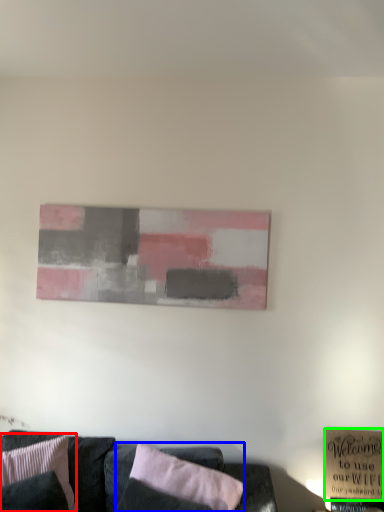
Question: Estimate the real-world distances between objects in this image. Which object is closer to pillow (highlighted by a red box), pillow (highlighted by a blue box) or plaque (highlighted by a green box)?

Choices:
 (A) pillow
 (B) plaque

Answer: (A)